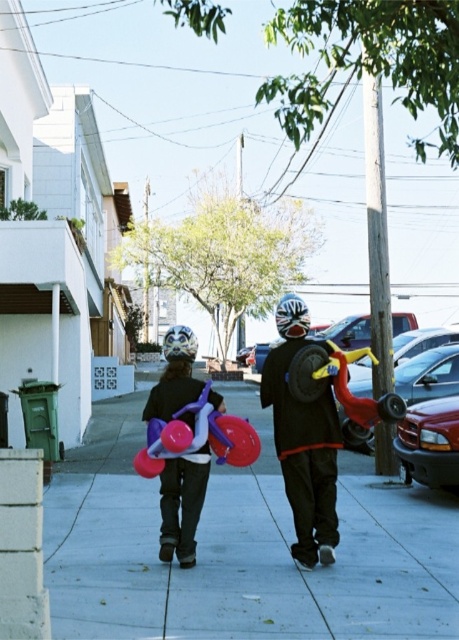
Question: Is matte black helmet at center to the right of white matte helmet at center from the viewer's perspective?

Choices:
 (A) no
 (B) yes

Answer: (A)

Question: Can you confirm if matte purple balloon at center is smaller than purple glossy balloon motorcycle at center?

Choices:
 (A) no
 (B) yes

Answer: (A)

Question: Based on their relative distances, which object is farther from the white matte helmet at center?

Choices:
 (A) shiny metallic helmet at center
 (B) matte black helmet at center

Answer: (A)

Question: Which of the following is the farthest from the observer?

Choices:
 (A) (185, 378)
 (B) (326, 362)
 (C) (425, 579)
 (D) (184, 358)

Answer: (A)

Question: Is matte black helmet at center bigger than rubberized yellow and red scooter at center?

Choices:
 (A) yes
 (B) no

Answer: (A)

Question: Which point is closer to the camera?

Choices:
 (A) purple glossy balloon motorcycle at center
 (B) white matte helmet at center

Answer: (A)